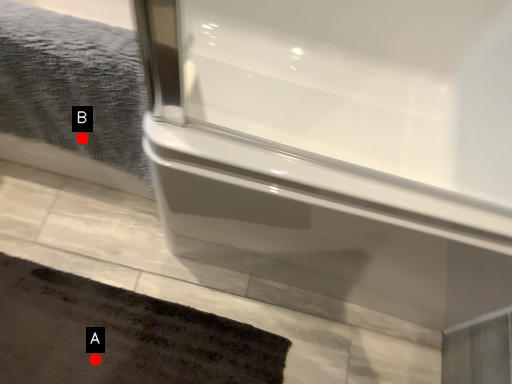
Question: Two points are circled on the image, labeled by A and B beside each circle. Which point is further to the camera?

Choices:
 (A) A is further
 (B) B is further

Answer: (A)